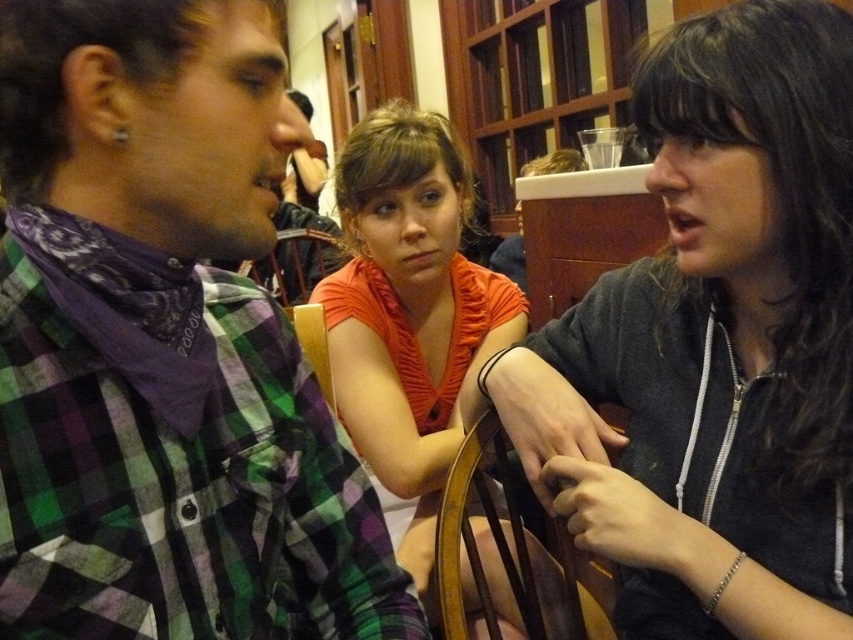
Is point (258, 483) more distant than point (402, 440)?

No.

From the picture: Which is more to the right, green plaid shirt at left or orange fabric shirt at center?

From the viewer's perspective, orange fabric shirt at center appears more on the right side.

Is point (161, 467) positioned in front of point (415, 564)?

Yes, point (161, 467) is closer to viewer.

The image size is (853, 640). In order to click on green plaid shirt at left in this screenshot , I will do `click(164, 346)`.

Who is positioned more to the left, green plaid shirt at left or dark gray hoodie at center right?

Positioned to the left is green plaid shirt at left.

Looking at this image, does green plaid shirt at left appear over dark gray hoodie at center right?

Incorrect, green plaid shirt at left is not positioned above dark gray hoodie at center right.

You are a GUI agent. You are given a task and a screenshot of the screen. Output one action in this format:
    pyautogui.click(x=<x>, y=<y>)
    Task: Click on the green plaid shirt at left
    Image resolution: width=853 pixels, height=640 pixels.
    Given the screenshot: What is the action you would take?
    pyautogui.click(x=164, y=346)

The image size is (853, 640). I want to click on green plaid shirt at left, so click(164, 346).

Which is behind, point (701, 595) or point (384, 108)?

The point (384, 108) is more distant.

The height and width of the screenshot is (640, 853). Describe the element at coordinates (715, 344) in the screenshot. I see `dark gray hoodie at center right` at that location.

Identify the location of dark gray hoodie at center right. Image resolution: width=853 pixels, height=640 pixels. (715, 344).